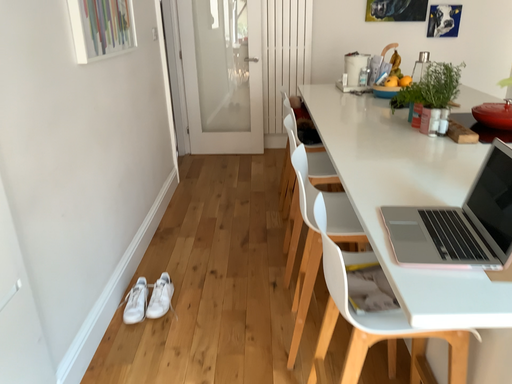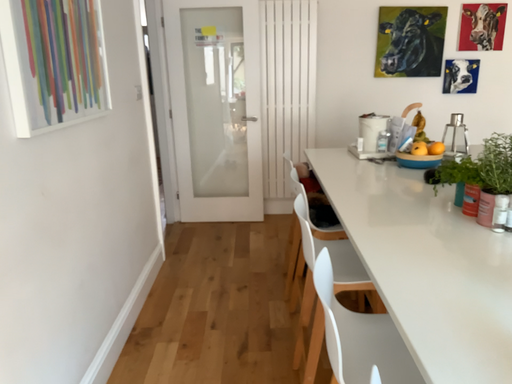
Question: Which way did the camera rotate in the video?

Choices:
 (A) rotated upward
 (B) rotated downward

Answer: (A)